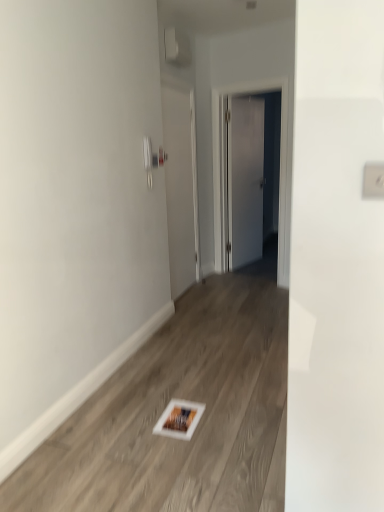
The height and width of the screenshot is (512, 384). Describe the element at coordinates (181, 188) in the screenshot. I see `white glossy door at center` at that location.

This screenshot has width=384, height=512. I want to click on white glossy door at center, so click(x=181, y=188).

This screenshot has width=384, height=512. I want to click on white glossy door at center, so click(x=181, y=188).